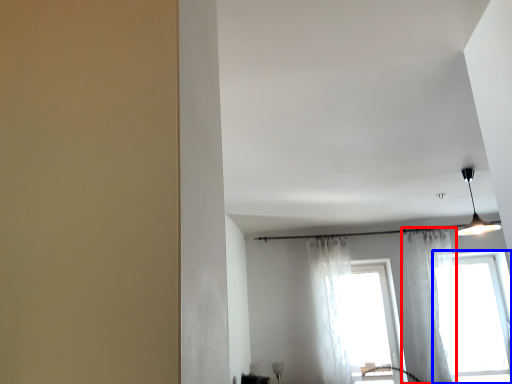
Question: Which object appears closest to the camera in this image, curtain (highlighted by a red box) or window (highlighted by a blue box)?

Choices:
 (A) curtain
 (B) window

Answer: (A)